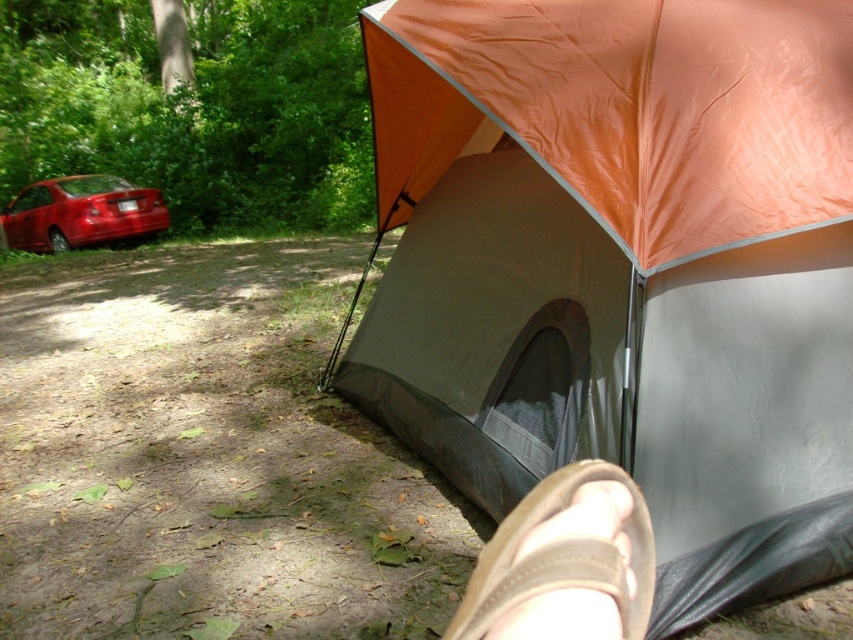
Who is positioned more to the left, orange tarpaulin tent at upper right or brown suede sandal at lower right?

Positioned to the left is brown suede sandal at lower right.

Identify the location of orange tarpaulin tent at upper right. The width and height of the screenshot is (853, 640). (625, 109).

Which of these two, orange tarpaulin tent at upper right or glossy red sedan at left, stands shorter?

Standing shorter between the two is orange tarpaulin tent at upper right.

Can you confirm if orange tarpaulin tent at upper right is bigger than glossy red sedan at left?

Actually, orange tarpaulin tent at upper right might be smaller than glossy red sedan at left.

Which is behind, point (456, 35) or point (41, 212)?

The point (41, 212) is more distant.

Where is `orange tarpaulin tent at upper right`? The width and height of the screenshot is (853, 640). orange tarpaulin tent at upper right is located at coordinates (625, 109).

Does orange tarpaulin tent at center appear on the right side of orange tarpaulin tent at upper right?

Incorrect, orange tarpaulin tent at center is not on the right side of orange tarpaulin tent at upper right.

Between orange tarpaulin tent at center and orange tarpaulin tent at upper right, which one has more height?

With more height is orange tarpaulin tent at center.

Does point (592, 212) come farther from viewer compared to point (680, 38)?

No, it is in front of (680, 38).

Find the location of a particular element. orange tarpaulin tent at center is located at coordinates (624, 268).